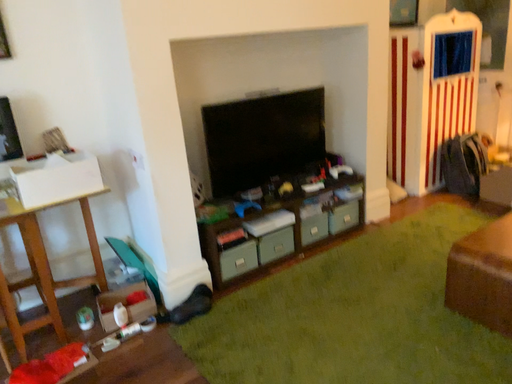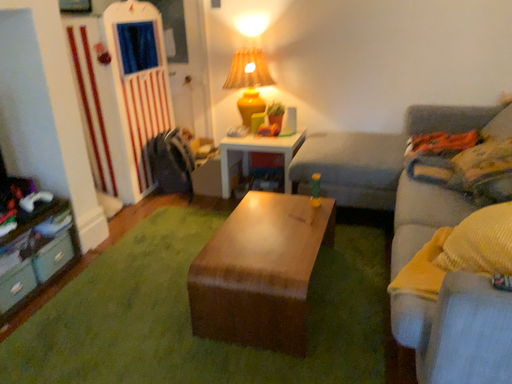
Question: How did the camera likely rotate when shooting the video?

Choices:
 (A) rotated right
 (B) rotated left

Answer: (A)